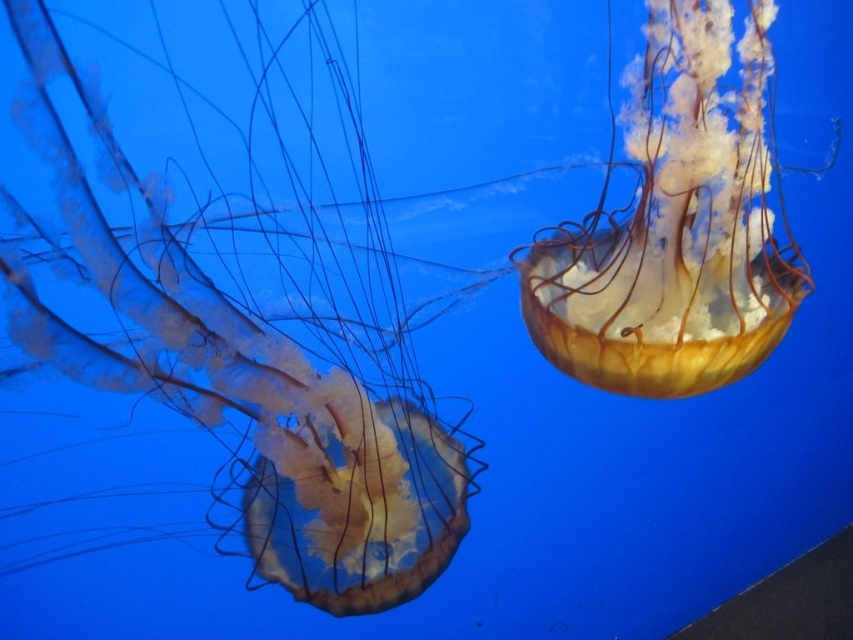
Is translucent gelatinous at left thinner than translucent yellowish jellyfish at upper right?

No.

Can you confirm if translucent gelatinous at left is taller than translucent yellowish jellyfish at upper right?

Yes, translucent gelatinous at left is taller than translucent yellowish jellyfish at upper right.

Where is `translucent gelatinous at left`? The width and height of the screenshot is (853, 640). translucent gelatinous at left is located at coordinates (244, 355).